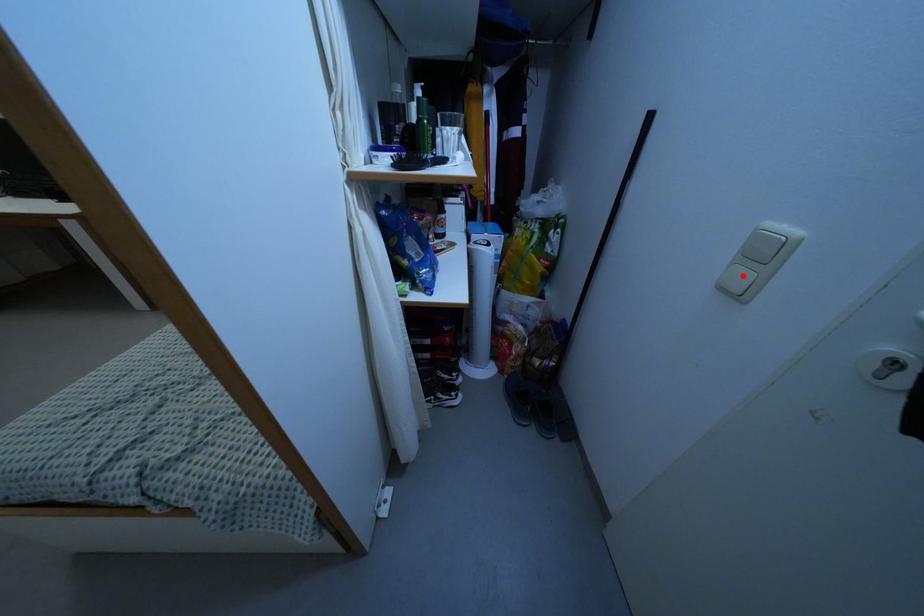
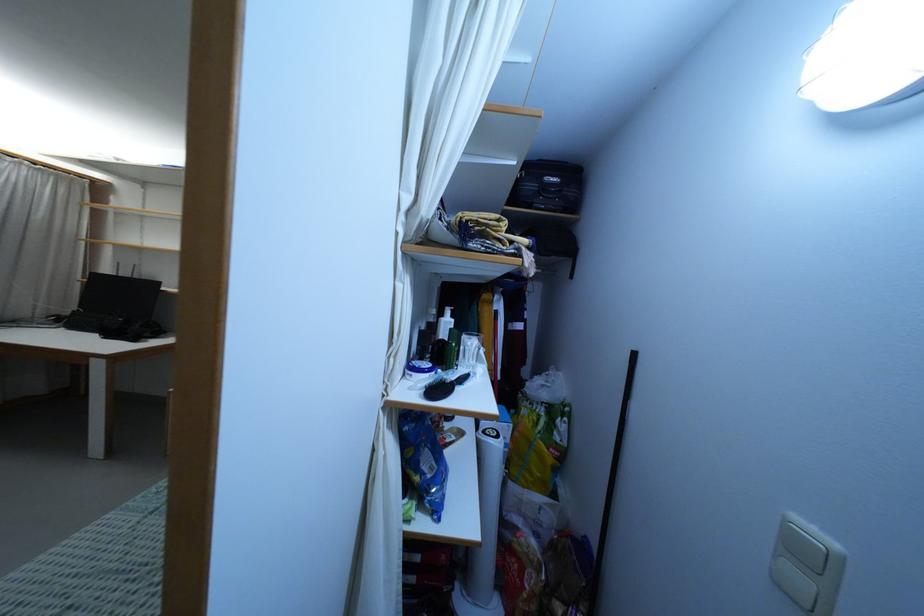
In the second image, find the point that corresponds to the highlighted location in the first image.

(799, 580)